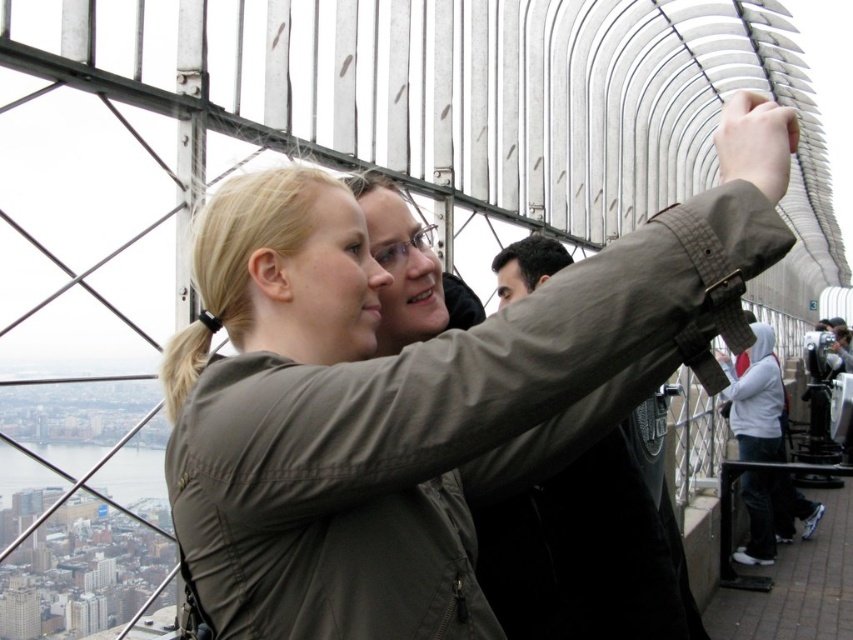
Is dark brown leather jacket at center further to camera compared to dark gray fabric at upper center?

That is False.

Does dark brown leather jacket at center have a lesser height compared to dark gray fabric at upper center?

No, dark brown leather jacket at center is not shorter than dark gray fabric at upper center.

Does point (595, 512) come farther from viewer compared to point (675, 547)?

No.

The width and height of the screenshot is (853, 640). What are the coordinates of `dark brown leather jacket at center` in the screenshot? It's located at (589, 554).

Can you confirm if matte olive green jacket at center is wider than dark gray fabric at upper center?

Correct, the width of matte olive green jacket at center exceeds that of dark gray fabric at upper center.

Who is more forward, (704, 198) or (555, 609)?

Point (704, 198) is more forward.

Who is more forward, (465, 628) or (637, 508)?

Positioned in front is point (465, 628).

What are the coordinates of `matte olive green jacket at center` in the screenshot? It's located at (410, 396).

Does dark brown leather jacket at center have a greater height compared to dark brown hair at center?

Yes.

What do you see at coordinates (589, 554) in the screenshot? The image size is (853, 640). I see `dark brown leather jacket at center` at bounding box center [589, 554].

What are the coordinates of `dark brown leather jacket at center` in the screenshot? It's located at (589, 554).